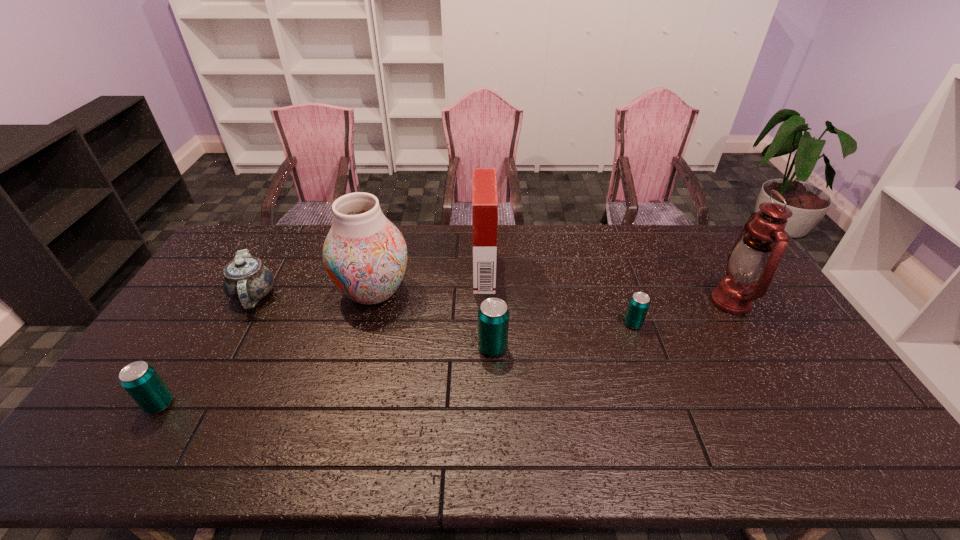
Locate an element on the screen. This screenshot has width=960, height=540. the nearest object is located at coordinates (140, 380).

Where is `the second shortest beer can`? This screenshot has width=960, height=540. the second shortest beer can is located at coordinates (140, 380).

Find the location of a particular element. The width and height of the screenshot is (960, 540). the second nearest beer can is located at coordinates (493, 315).

Identify the location of the second beer can from left to right. Image resolution: width=960 pixels, height=540 pixels. (493, 315).

The height and width of the screenshot is (540, 960). Identify the location of the farthest beer can. (639, 303).

This screenshot has width=960, height=540. I want to click on the shortest beer can, so click(639, 303).

Locate an element on the screen. The image size is (960, 540). cigarette_case is located at coordinates (485, 200).

Locate an element on the screen. The height and width of the screenshot is (540, 960). the third object from left to right is located at coordinates (365, 255).

You are a GUI agent. You are given a task and a screenshot of the screen. Output one action in this format:
    pyautogui.click(x=<x>, y=<y>)
    Task: Click on the rightmost object
    
    Given the screenshot: What is the action you would take?
    pyautogui.click(x=756, y=255)

At what (x,y) coordinates should I click in order to perform the action: click on chinaware. Please return your answer as a coordinate pair (x, y). This screenshot has width=960, height=540. Looking at the image, I should click on point(246,280).